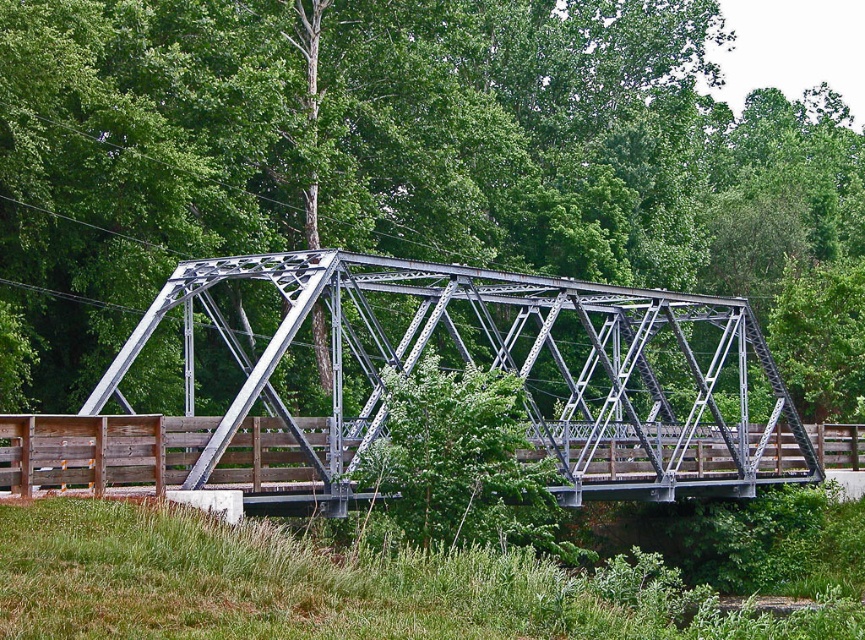
Question: Does green leafy tree at center come in front of metallic gray bridge at center?

Choices:
 (A) yes
 (B) no

Answer: (B)

Question: Does green leafy tree at center have a smaller size compared to metallic gray bridge at center?

Choices:
 (A) no
 (B) yes

Answer: (A)

Question: Which point is closer to the camera?

Choices:
 (A) green leafy tree at center
 (B) metallic gray bridge at center

Answer: (B)

Question: In this image, where is green leafy tree at center located relative to metallic gray bridge at center?

Choices:
 (A) below
 (B) above

Answer: (B)

Question: Which object is farther from the camera taking this photo?

Choices:
 (A) metallic gray bridge at center
 (B) green leafy tree at center

Answer: (B)